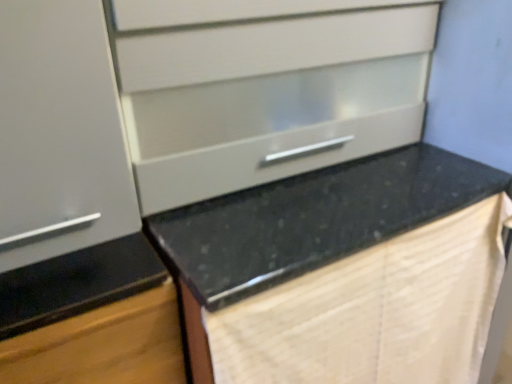
Question: Is beige textured blanket at lower right surrounding matte white drawer at upper center?

Choices:
 (A) yes
 (B) no

Answer: (B)

Question: From a real-world perspective, is beige textured blanket at lower right on matte white drawer at upper center?

Choices:
 (A) no
 (B) yes

Answer: (A)

Question: From a real-world perspective, is beige textured blanket at lower right located beneath matte white drawer at upper center?

Choices:
 (A) no
 (B) yes

Answer: (B)

Question: Is beige textured blanket at lower right next to matte white drawer at upper center?

Choices:
 (A) no
 (B) yes

Answer: (A)

Question: Does beige textured blanket at lower right have a greater height compared to matte white drawer at upper center?

Choices:
 (A) yes
 (B) no

Answer: (A)

Question: From a real-world perspective, is black granite countertop at center physically located above or below matte white drawer at upper center?

Choices:
 (A) below
 (B) above

Answer: (A)

Question: From their relative heights in the image, would you say black granite countertop at center is taller or shorter than matte white drawer at upper center?

Choices:
 (A) short
 (B) tall

Answer: (B)

Question: Looking at their shapes, would you say black granite countertop at center is wider or thinner than matte white drawer at upper center?

Choices:
 (A) thin
 (B) wide

Answer: (B)

Question: Would you say black granite countertop at center is to the left or to the right of matte white drawer at upper center in the picture?

Choices:
 (A) right
 (B) left

Answer: (A)

Question: In terms of height, does black granite countertop at center look taller or shorter compared to beige textured blanket at lower right?

Choices:
 (A) tall
 (B) short

Answer: (A)

Question: Looking at their shapes, would you say black granite countertop at center is wider or thinner than beige textured blanket at lower right?

Choices:
 (A) wide
 (B) thin

Answer: (A)

Question: From a real-world perspective, relative to beige textured blanket at lower right, is black granite countertop at center vertically above or below?

Choices:
 (A) above
 (B) below

Answer: (B)

Question: Considering the positions of black granite countertop at center and beige textured blanket at lower right in the image, is black granite countertop at center bigger or smaller than beige textured blanket at lower right?

Choices:
 (A) big
 (B) small

Answer: (A)

Question: Based on their sizes in the image, would you say beige textured blanket at lower right is bigger or smaller than matte white cabinet at left, arranged as the 1th cabinetry when viewed from the top?

Choices:
 (A) small
 (B) big

Answer: (B)

Question: Is beige textured blanket at lower right situated inside matte white cabinet at left, the second cabinetry ordered from the bottom, or outside?

Choices:
 (A) inside
 (B) outside

Answer: (B)